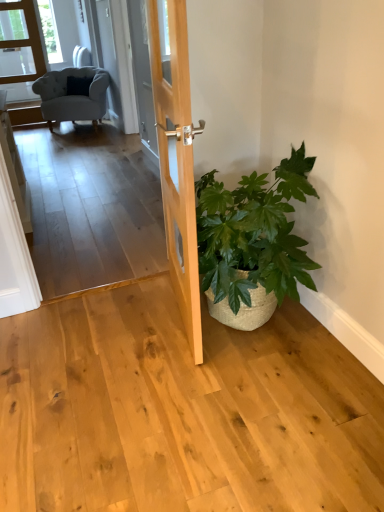
Question: From the image's perspective, is green woven basket at lower right located above or below light gray fabric armchair at upper left?

Choices:
 (A) below
 (B) above

Answer: (A)

Question: Is green woven basket at lower right wider or thinner than light gray fabric armchair at upper left?

Choices:
 (A) wide
 (B) thin

Answer: (B)

Question: Estimate the real-world distances between objects in this image. Which object is farther from the light brown wood door at center?

Choices:
 (A) light gray fabric armchair at upper left
 (B) transparent glass door at upper left
 (C) green woven basket at lower right

Answer: (B)

Question: Which of these objects is positioned closest to the light brown wood door at center?

Choices:
 (A) light gray fabric armchair at upper left
 (B) transparent glass door at upper left
 (C) green woven basket at lower right

Answer: (C)